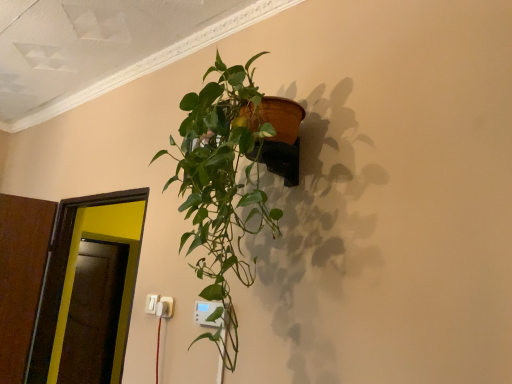
Question: Is white plastic electric outlet at lower center, which is the 2th electric outlet in front-to-back order, at the back of white plastic electric outlet at lower left, the third electric outlet viewed from the right?

Choices:
 (A) yes
 (B) no

Answer: (B)

Question: Can you confirm if white plastic electric outlet at lower left, the third electric outlet viewed from the right, is bigger than white plastic electric outlet at lower center, the second electric outlet from the back?

Choices:
 (A) yes
 (B) no

Answer: (A)

Question: Is white plastic electric outlet at lower left, the third electric outlet viewed from the right, smaller than white plastic electric outlet at lower center, which is the 2th electric outlet in front-to-back order?

Choices:
 (A) no
 (B) yes

Answer: (A)

Question: From a real-world perspective, is white plastic electric outlet at lower left, positioned as the first electric outlet in back-to-front order, beneath white plastic electric outlet at lower center, the second electric outlet in the right-to-left sequence?

Choices:
 (A) yes
 (B) no

Answer: (B)

Question: Is white plastic electric outlet at lower left, which is the 1th electric outlet from left to right, next to white plastic electric outlet at lower center, the second electric outlet in the right-to-left sequence?

Choices:
 (A) yes
 (B) no

Answer: (A)

Question: Considering the positions of white plastic electric outlet at lower center, acting as the 3th electric outlet starting from the left, and green glossy plant at upper center in the image, is white plastic electric outlet at lower center, acting as the 3th electric outlet starting from the left, wider or thinner than green glossy plant at upper center?

Choices:
 (A) wide
 (B) thin

Answer: (B)

Question: Is white plastic electric outlet at lower center, acting as the 3th electric outlet starting from the left, to the left or to the right of green glossy plant at upper center in the image?

Choices:
 (A) left
 (B) right

Answer: (A)

Question: From a real-world perspective, is white plastic electric outlet at lower center, the first electric outlet when ordered from front to back, above or below green glossy plant at upper center?

Choices:
 (A) above
 (B) below

Answer: (B)

Question: Considering the positions of white plastic electric outlet at lower center, the first electric outlet when ordered from front to back, and green glossy plant at upper center in the image, is white plastic electric outlet at lower center, the first electric outlet when ordered from front to back, bigger or smaller than green glossy plant at upper center?

Choices:
 (A) big
 (B) small

Answer: (B)

Question: Is point (241, 107) closer or farther from the camera than point (151, 301)?

Choices:
 (A) farther
 (B) closer

Answer: (B)

Question: From a real-world perspective, relative to white plastic electric outlet at lower left, which is the 1th electric outlet from left to right, is green glossy plant at upper center vertically above or below?

Choices:
 (A) above
 (B) below

Answer: (A)

Question: From the image's perspective, relative to white plastic electric outlet at lower left, the third electric outlet positioned from the front, is green glossy plant at upper center above or below?

Choices:
 (A) below
 (B) above

Answer: (B)

Question: Considering their positions, is green glossy plant at upper center located in front of or behind white plastic electric outlet at lower left, which is the 1th electric outlet from left to right?

Choices:
 (A) front
 (B) behind

Answer: (A)

Question: Would you say white plastic electric outlet at lower left, positioned as the first electric outlet in back-to-front order, is inside or outside transparent glass door at left?

Choices:
 (A) inside
 (B) outside

Answer: (B)

Question: Looking at the image, does white plastic electric outlet at lower left, positioned as the first electric outlet in back-to-front order, seem bigger or smaller compared to transparent glass door at left?

Choices:
 (A) big
 (B) small

Answer: (B)